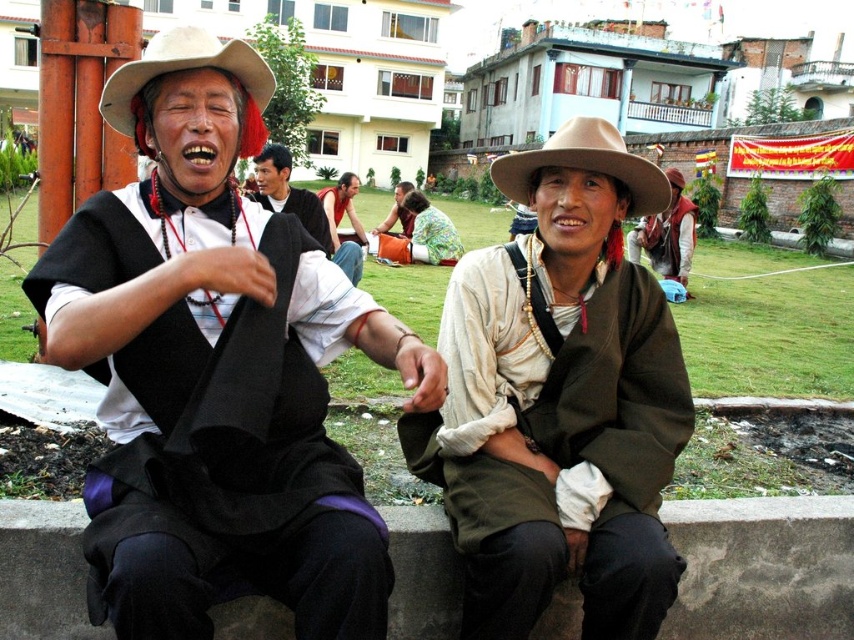
You are a photographer trying to capture a closeup of the matte black tie at center and floral fabric shirt at center. Which one is closer to the camera lens?

The matte black tie at center is positioned under the floral fabric shirt at center, so the floral fabric shirt at center is closer to the camera lens.

You are standing at the origin of a coordinate system where the bottom left corner of the image is the origin. The coordinates are given as a pair of values between 0 and 1. The person with the matte brown jacket at center is located at point (560, 401). If you want to walk directly to the matte brown jacket at center, in which direction should you move from the origin?

To reach the matte brown jacket at center located at coordinates (560, 401) from the origin at the bottom left corner, you should move northeast. This is because the x and y coordinates are both greater than 0.5, indicating the position is to the right and above the center point of the image.